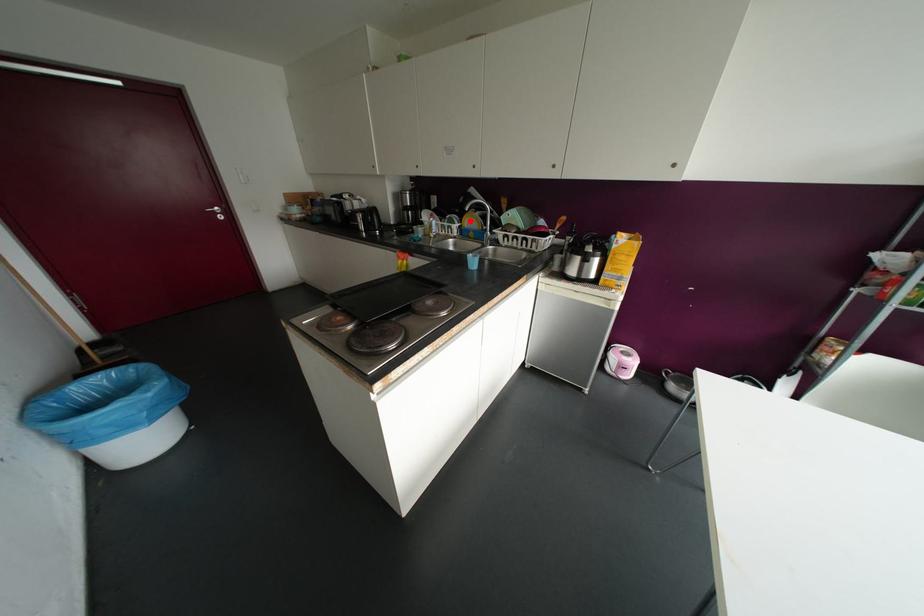
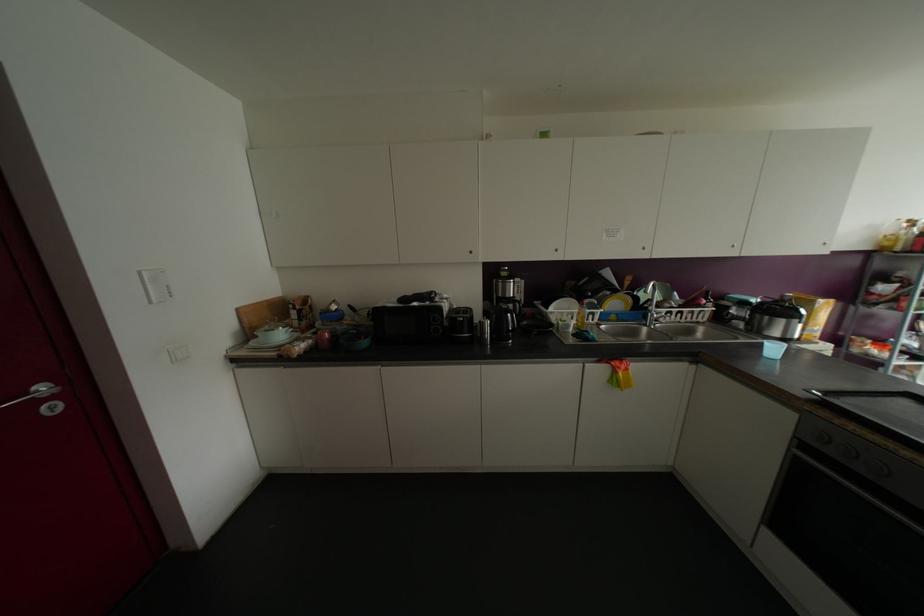
Question: I am providing you with two images of the same scene from different viewpoints. A red point is shown in image1. For the corresponding object point in image2, is it positioned nearer or farther from the camera?

Choices:
 (A) Nearer
 (B) Farther

Answer: (B)